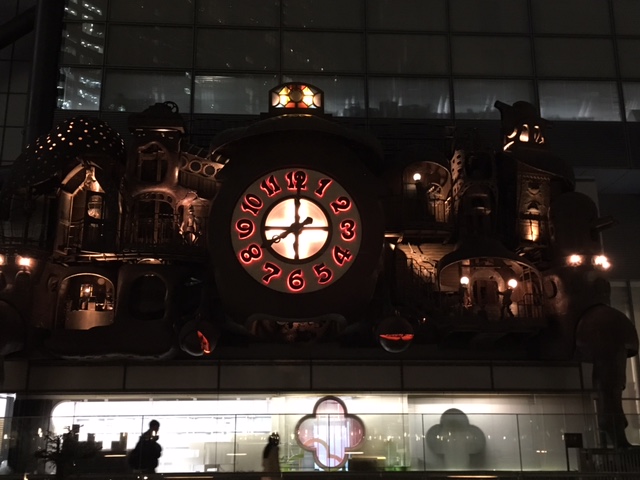
Find the location of a particular element. The image size is (640, 480). clock is located at coordinates 296,244.